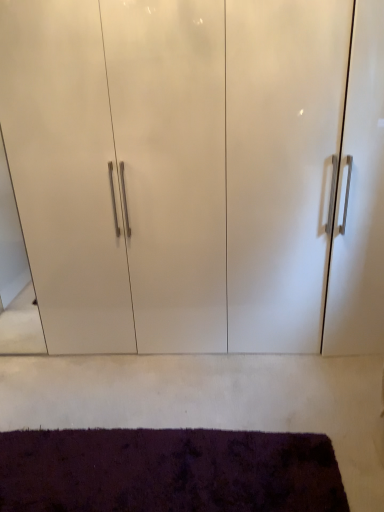
Image resolution: width=384 pixels, height=512 pixels. Describe the element at coordinates (199, 172) in the screenshot. I see `white glossy cabinet at center` at that location.

Find the location of `white glossy cabinet at center`. white glossy cabinet at center is located at coordinates (199, 172).

The height and width of the screenshot is (512, 384). What do you see at coordinates (168, 471) in the screenshot?
I see `dark purple shaggy rug at lower center` at bounding box center [168, 471].

What is the approximate width of dark purple shaggy rug at lower center?

16.66 inches.

At what (x,y) coordinates should I click in order to perform the action: click on dark purple shaggy rug at lower center. Please return your answer as a coordinate pair (x, y). The height and width of the screenshot is (512, 384). Looking at the image, I should click on tap(168, 471).

What is the approximate height of dark purple shaggy rug at lower center?

The height of dark purple shaggy rug at lower center is 2.30 inches.

What are the coordinates of `white glossy cabinet at center` in the screenshot? It's located at pyautogui.click(x=199, y=172).

Can you confirm if dark purple shaggy rug at lower center is positioned to the left of white glossy cabinet at center?

Indeed, dark purple shaggy rug at lower center is positioned on the left side of white glossy cabinet at center.

Is dark purple shaggy rug at lower center positioned behind white glossy cabinet at center?

No, it is in front of white glossy cabinet at center.

Which is less distant, (94, 475) or (38, 279)?

Point (94, 475).

From the image's perspective, relative to white glossy cabinet at center, is dark purple shaggy rug at lower center above or below?

dark purple shaggy rug at lower center is situated lower than white glossy cabinet at center in the image.

From a real-world perspective, which is physically below, dark purple shaggy rug at lower center or white glossy cabinet at center?

dark purple shaggy rug at lower center.

Can you confirm if dark purple shaggy rug at lower center is wider than white glossy cabinet at center?

No.

Is dark purple shaggy rug at lower center shorter than white glossy cabinet at center?

Yes, dark purple shaggy rug at lower center is shorter than white glossy cabinet at center.

Does dark purple shaggy rug at lower center have a larger size compared to white glossy cabinet at center?

Actually, dark purple shaggy rug at lower center might be smaller than white glossy cabinet at center.

Is white glossy cabinet at center a part of dark purple shaggy rug at lower center?

That's incorrect, white glossy cabinet at center is not inside dark purple shaggy rug at lower center.

Are dark purple shaggy rug at lower center and white glossy cabinet at center located far from each other?

Actually, dark purple shaggy rug at lower center and white glossy cabinet at center are a little close together.

Does dark purple shaggy rug at lower center turn towards white glossy cabinet at center?

No, dark purple shaggy rug at lower center is not aimed at white glossy cabinet at center.

Can you tell me how much dark purple shaggy rug at lower center and white glossy cabinet at center differ in facing direction?

They differ by 0.15 degrees in their facing directions.

How far apart are dark purple shaggy rug at lower center and white glossy cabinet at center?

A distance of 38.07 inches exists between dark purple shaggy rug at lower center and white glossy cabinet at center.

At what (x,y) coordinates should I click in order to perform the action: click on mat below the white glossy cabinet at center (from a real-world perspective). Please return your answer as a coordinate pair (x, y). Looking at the image, I should click on (168, 471).

Looking at this image, between white glossy cabinet at center and dark purple shaggy rug at lower center, which one appears on the left side from the viewer's perspective?

dark purple shaggy rug at lower center is more to the left.

Is the position of white glossy cabinet at center more distant than that of dark purple shaggy rug at lower center?

Yes.

Considering the positions of point (169, 78) and point (6, 500), is point (169, 78) closer or farther from the camera than point (6, 500)?

Point (169, 78) appears to be farther away from the viewer than point (6, 500).

From the image's perspective, is white glossy cabinet at center located above dark purple shaggy rug at lower center?

Indeed, from the image's perspective, white glossy cabinet at center is shown above dark purple shaggy rug at lower center.

From a real-world perspective, is white glossy cabinet at center below dark purple shaggy rug at lower center?

No, from a real-world perspective, white glossy cabinet at center is not under dark purple shaggy rug at lower center.

Does white glossy cabinet at center have a lesser width compared to dark purple shaggy rug at lower center?

No, white glossy cabinet at center is not thinner than dark purple shaggy rug at lower center.

Is white glossy cabinet at center taller or shorter than dark purple shaggy rug at lower center?

Clearly, white glossy cabinet at center is taller compared to dark purple shaggy rug at lower center.

Which of these two, white glossy cabinet at center or dark purple shaggy rug at lower center, is smaller?

Smaller between the two is dark purple shaggy rug at lower center.

In the scene shown: Is white glossy cabinet at center spatially inside dark purple shaggy rug at lower center, or outside of it?

white glossy cabinet at center exists outside the volume of dark purple shaggy rug at lower center.

Would you say white glossy cabinet at center is a long distance from dark purple shaggy rug at lower center?

No, white glossy cabinet at center is not far from dark purple shaggy rug at lower center.

Is dark purple shaggy rug at lower center at the back of white glossy cabinet at center?

No, white glossy cabinet at center is not facing away from dark purple shaggy rug at lower center.

How many degrees apart are the facing directions of white glossy cabinet at center and dark purple shaggy rug at lower center?

0.15 degrees.

How far apart are white glossy cabinet at center and dark purple shaggy rug at lower center?

They are 38.07 inches apart.

Find the location of a particular element. The height and width of the screenshot is (512, 384). cupboard above the dark purple shaggy rug at lower center (from the image's perspective) is located at coordinates (199, 172).

Locate an element on the screen. cupboard on the right of dark purple shaggy rug at lower center is located at coordinates (199, 172).

At what (x,y) coordinates should I click in order to perform the action: click on mat below the white glossy cabinet at center (from a real-world perspective). Please return your answer as a coordinate pair (x, y). Image resolution: width=384 pixels, height=512 pixels. Looking at the image, I should click on (168, 471).